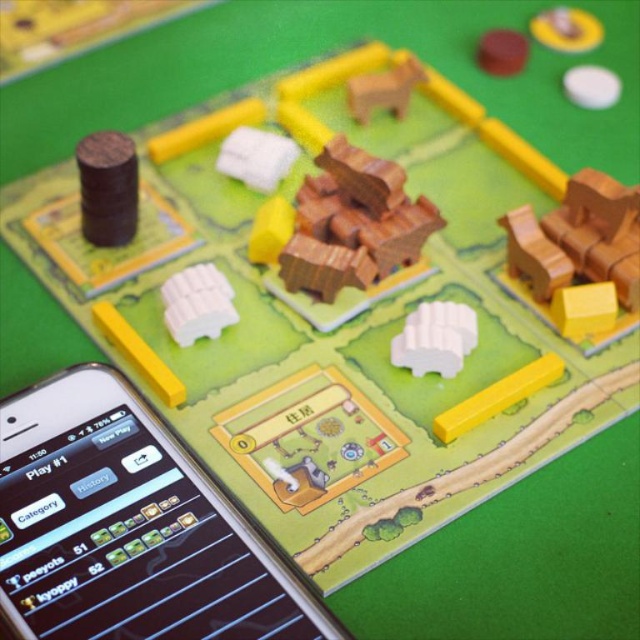
You are setting up a board game and need to place the dark brown wood cylinder at left and the white matte gear at center according to the instructions. The manual says that one of these pieces must be placed above the other. Based on the game board layout described, which piece should be placed above the other?

The dark brown wood cylinder at left should be placed above the white matte gear at center because the description states that the dark brown wood cylinder at left is above white matte gear at center.

You are a game piece that is 2 inches in diameter. You are currently positioned at the dark brown wood cylinder at left and need to reach the white matte gear at center. Can you move directly to the gear without any obstruction?

The distance between the dark brown wood cylinder at left and the white matte gear at center is 22.80 inches. Since you are only 2 inches in diameter, you can move directly to the gear without any obstruction as the path is clear.

You are playing a board game and need to place your next move. You have a black glossy smartphone at lower left and a dark brown wood cylinder at left. Which object is positioned lower on the board?

The black glossy smartphone at lower left is positioned below the dark brown wood cylinder at left, so it is lower on the board.